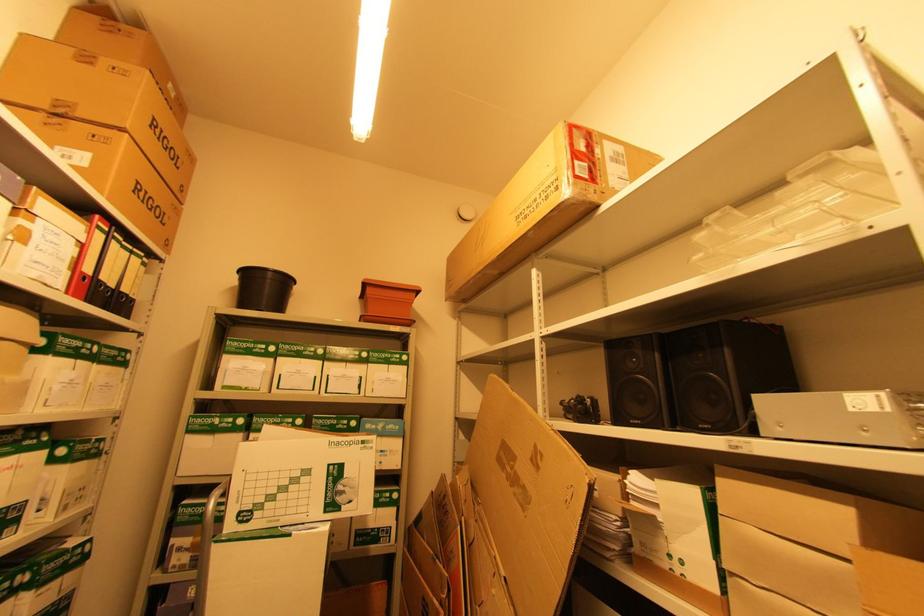
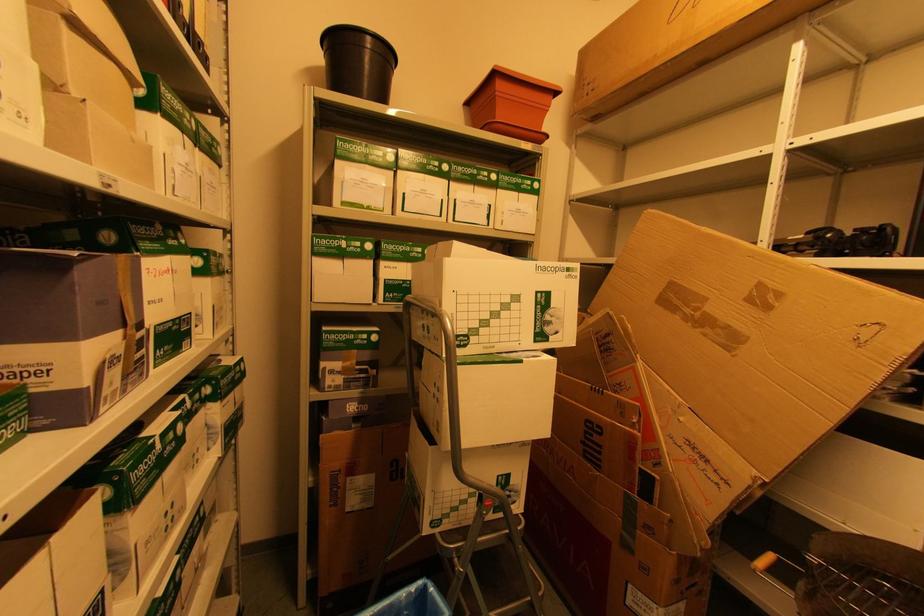
The images are taken continuously from a first-person perspective. In which direction are you moving?

The cameraman moved toward left, forward.